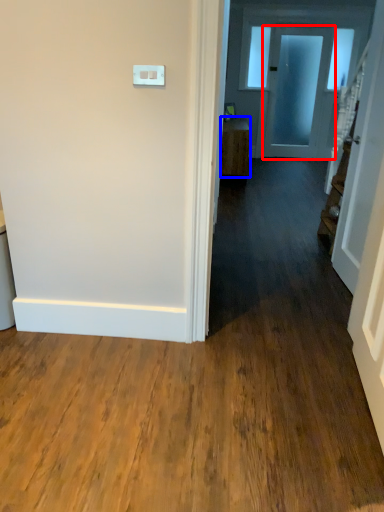
Question: Among these objects, which one is nearest to the camera, door (highlighted by a red box) or furniture (highlighted by a blue box)?

Choices:
 (A) door
 (B) furniture

Answer: (B)